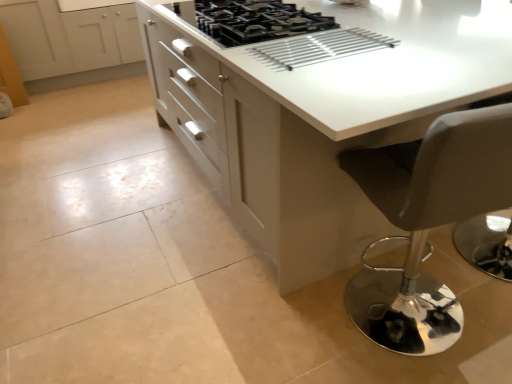
Question: Is white glossy cabinet at upper left situated inside matte black stool at lower right or outside?

Choices:
 (A) outside
 (B) inside

Answer: (A)

Question: Does point (93, 66) appear closer or farther from the camera than point (460, 201)?

Choices:
 (A) farther
 (B) closer

Answer: (A)

Question: Which of these objects is positioned closest to the black matte gas stove at center?

Choices:
 (A) matte black stool at lower right
 (B) white glossy cabinet at upper left
 (C) white glossy countertop at center

Answer: (C)

Question: Which object is the farthest from the matte black stool at lower right?

Choices:
 (A) white glossy countertop at center
 (B) black matte gas stove at center
 (C) white glossy cabinet at upper left

Answer: (C)